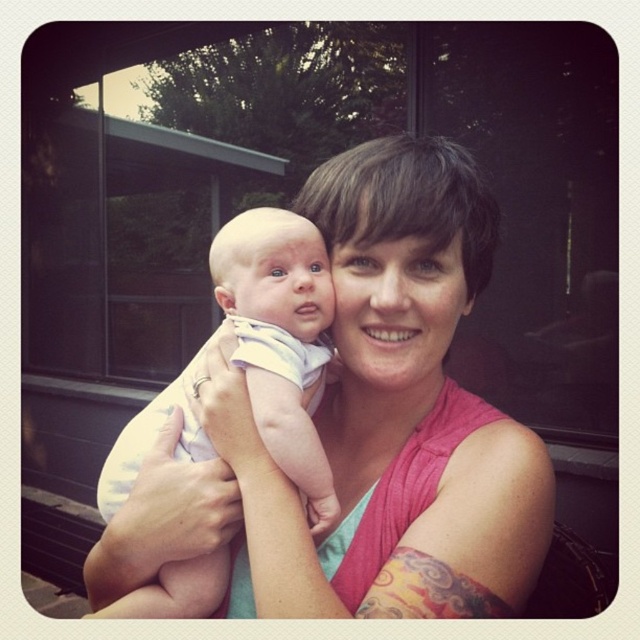
Question: Is pink fabric tank top at center positioned in front of light blue cotton onesie at center?

Choices:
 (A) no
 (B) yes

Answer: (B)

Question: Considering the relative positions of pink fabric tank top at center and light blue cotton onesie at center in the image provided, where is pink fabric tank top at center located with respect to light blue cotton onesie at center?

Choices:
 (A) above
 (B) below

Answer: (A)

Question: Which point is farther to the camera?

Choices:
 (A) (204, 502)
 (B) (148, 410)

Answer: (B)

Question: Can you confirm if pink fabric tank top at center is thinner than light blue cotton onesie at center?

Choices:
 (A) yes
 (B) no

Answer: (B)